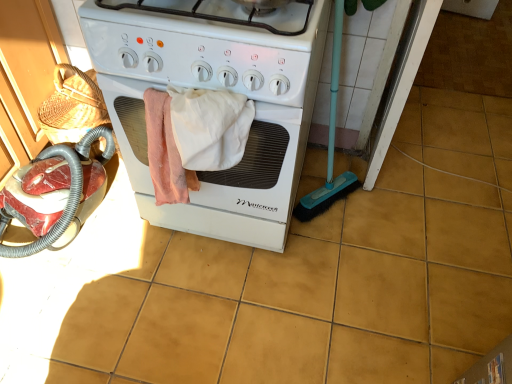
This screenshot has width=512, height=384. I want to click on free spot in front of yellow matte tile at center, so click(x=476, y=222).